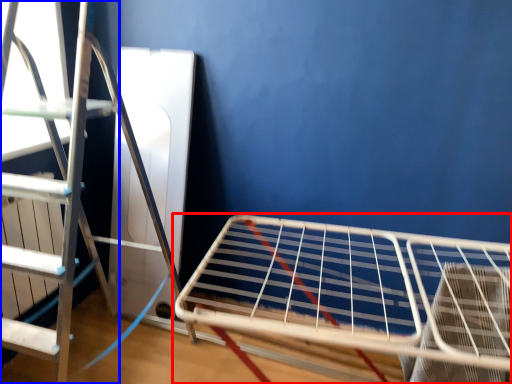
Question: Which object is further to the camera taking this photo, furniture (highlighted by a red box) or ladder (highlighted by a blue box)?

Choices:
 (A) furniture
 (B) ladder

Answer: (B)